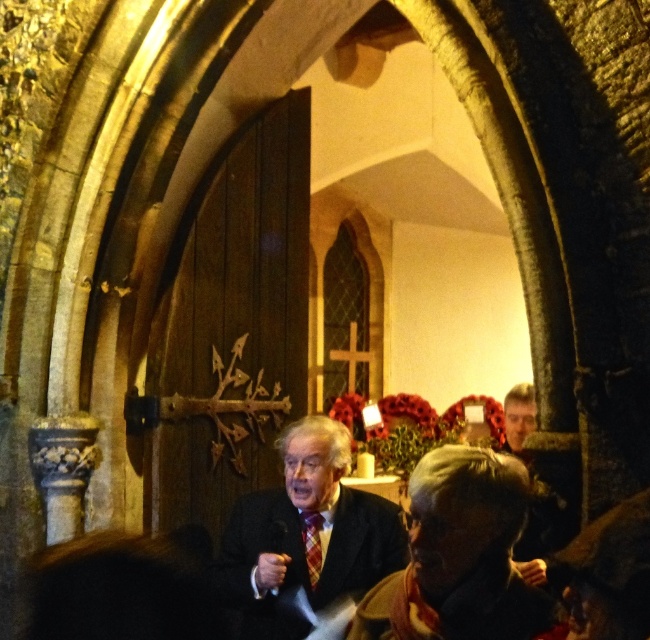
Which is more to the right, dark brown leather jacket at lower center or matte black suit at center?

From the viewer's perspective, dark brown leather jacket at lower center appears more on the right side.

Who is shorter, dark brown leather jacket at lower center or matte black suit at center?

dark brown leather jacket at lower center

Is point (413, 593) in front of point (248, 577)?

Yes.

At what (x,y) coordinates should I click in order to perform the action: click on dark brown leather jacket at lower center. Please return your answer as a coordinate pair (x, y). This screenshot has width=650, height=640. Looking at the image, I should click on click(x=458, y=556).

Does dark brown leather jacket at lower center appear over plaid fabric tie at center?

Yes.

Based on the photo, between dark brown leather jacket at lower center and plaid fabric tie at center, which one appears on the right side from the viewer's perspective?

Positioned to the right is dark brown leather jacket at lower center.

Where is `dark brown leather jacket at lower center`? Image resolution: width=650 pixels, height=640 pixels. dark brown leather jacket at lower center is located at coordinates (458, 556).

I want to click on dark brown leather jacket at lower center, so click(x=458, y=556).

Who is more forward, (280, 524) or (309, 522)?

Positioned in front is point (280, 524).

Does matte black suit at center have a larger size compared to plaid fabric tie at center?

Yes.

Is point (382, 540) positioned behind point (318, 552)?

Yes, point (382, 540) is behind point (318, 552).

Where is `matte black suit at center`? The width and height of the screenshot is (650, 640). matte black suit at center is located at coordinates (302, 532).